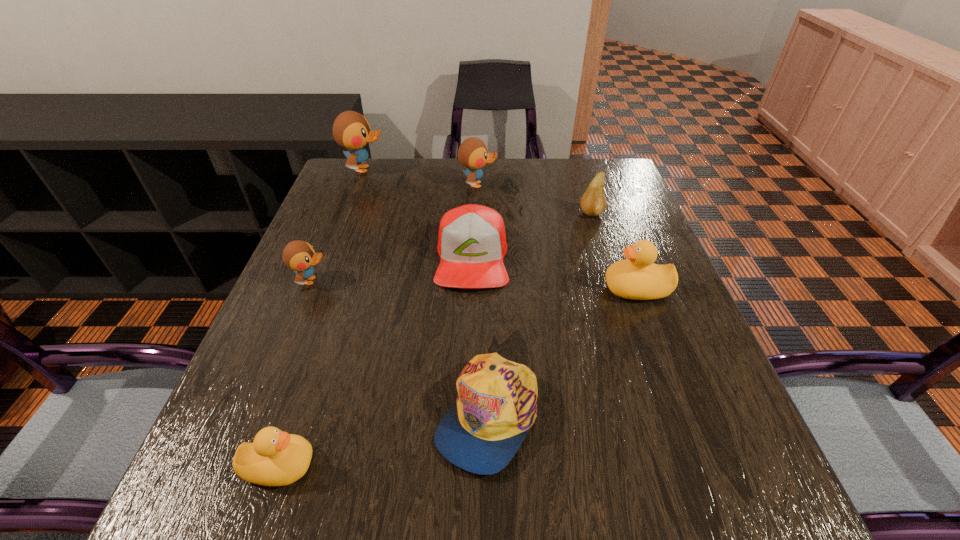
In order to click on the nearer yellow duck in this screenshot , I will do `click(275, 458)`.

Where is `cap`? This screenshot has height=540, width=960. cap is located at coordinates (496, 405).

Where is `free space located on the front-facing side of the tallest object`? The height and width of the screenshot is (540, 960). free space located on the front-facing side of the tallest object is located at coordinates (481, 169).

Image resolution: width=960 pixels, height=540 pixels. What are the coordinates of `blank area located 0.210m on the front-facing side of the rightmost blue duck` in the screenshot? It's located at (568, 185).

Where is `free space located on the face of the bigger yellow duck`? The width and height of the screenshot is (960, 540). free space located on the face of the bigger yellow duck is located at coordinates (482, 289).

Find the location of `vacant position located on the face of the bigger yellow duck`. vacant position located on the face of the bigger yellow duck is located at coordinates (487, 289).

Locate an element on the screen. blank space located 0.190m on the face of the bigger yellow duck is located at coordinates (518, 289).

Image resolution: width=960 pixels, height=540 pixels. Find the location of `free space located on the front of the pear`. free space located on the front of the pear is located at coordinates (602, 247).

This screenshot has height=540, width=960. In order to click on vacant space located 0.100m on the front-facing side of the baseball cap in this screenshot , I will do `click(470, 329)`.

I want to click on vacant space located 0.260m on the front-facing side of the smallest blue duck, so click(x=444, y=281).